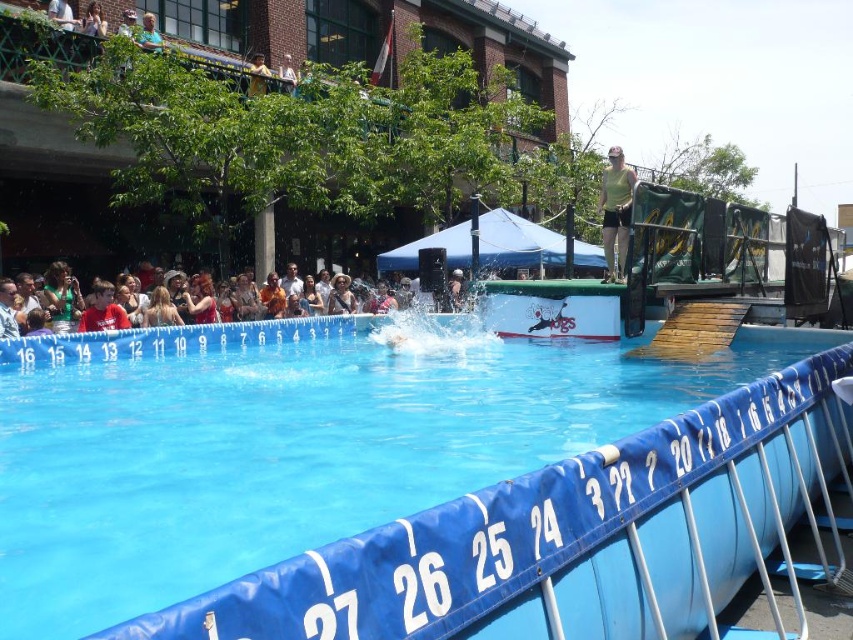
Question: Observing the image, what is the correct spatial positioning of green fabric shirt at left in reference to light brown leather hat at upper center?

Choices:
 (A) above
 (B) below

Answer: (B)

Question: Does matte brown hair at center appear on the right side of light brown leather hat at upper center?

Choices:
 (A) no
 (B) yes

Answer: (A)

Question: Is blue rubber pool at center further to the viewer compared to leather jacket at center?

Choices:
 (A) yes
 (B) no

Answer: (B)

Question: Which of the following is the closest to the observer?

Choices:
 (A) light brown leather hat at upper center
 (B) blue rubber pool at center
 (C) multicolored casual clothing at lower center

Answer: (B)

Question: Which point is closer to the camera?

Choices:
 (A) (70, 307)
 (B) (772, 428)
 (C) (262, 292)
 (D) (254, 307)

Answer: (B)

Question: Which point is closer to the camera taking this photo?

Choices:
 (A) (126, 312)
 (B) (254, 294)
 (C) (18, 452)

Answer: (C)